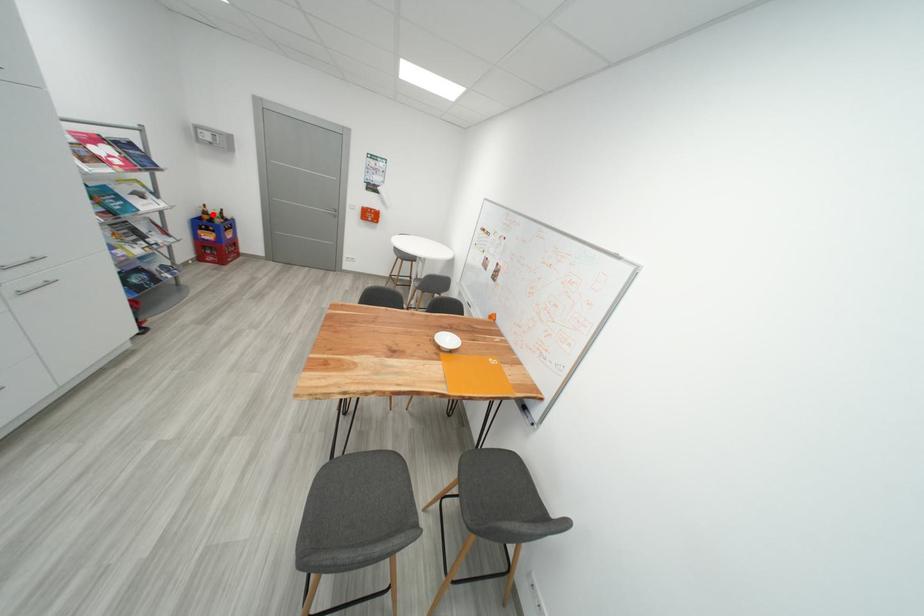
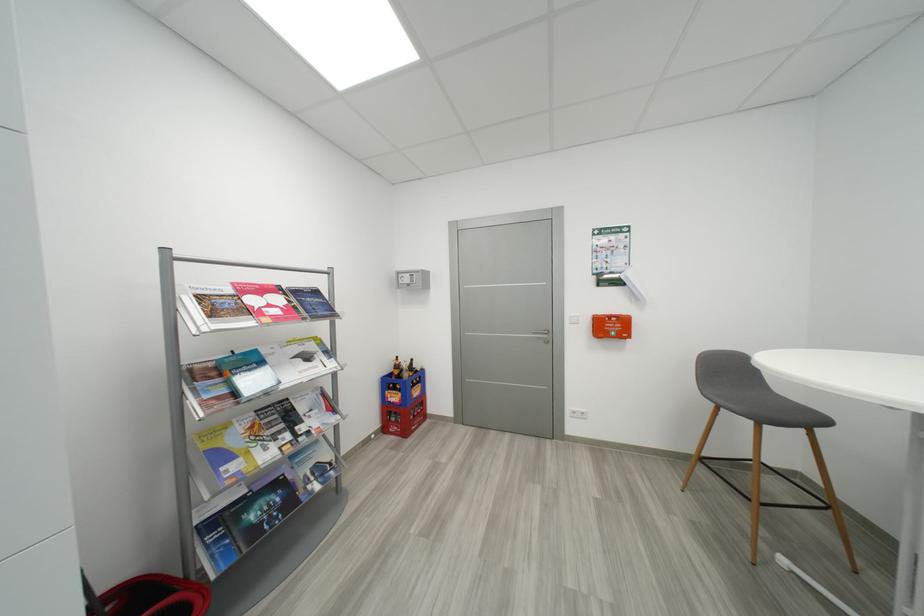
Question: I am providing you with two images of the same scene from different viewpoints. In image1, a red point is highlighted. Considering the same 3D point in image2, which of the following is correct?

Choices:
 (A) It is closer
 (B) It is farther

Answer: (B)